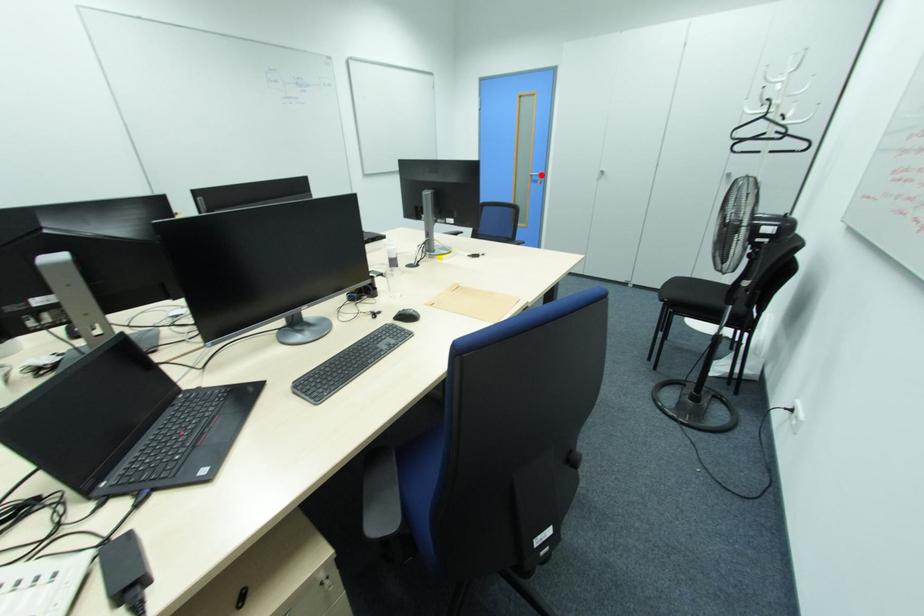
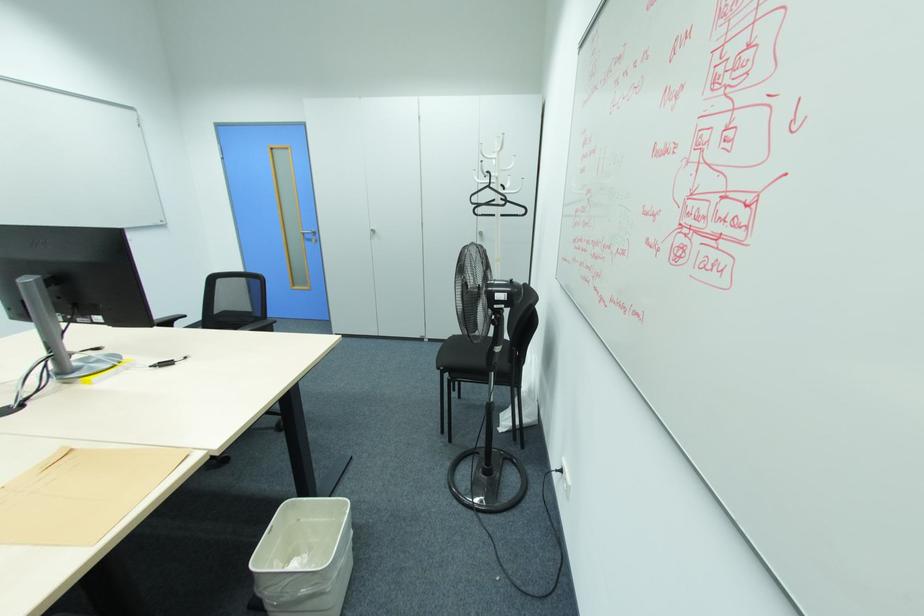
Find the pixel in the second image that matches the highlighted location in the first image.

(314, 233)